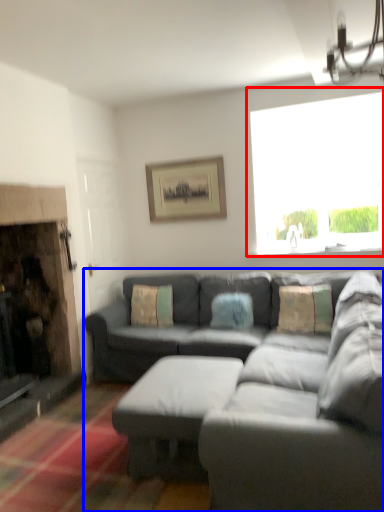
Question: Which object appears farthest to the camera in this image, window (highlighted by a red box) or studio couch (highlighted by a blue box)?

Choices:
 (A) window
 (B) studio couch

Answer: (A)